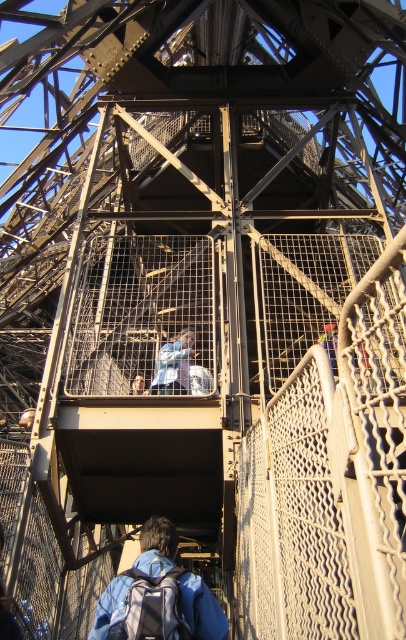
Does matte blue backpack at lower center have a larger size compared to light blue fabric at center?

Actually, matte blue backpack at lower center might be smaller than light blue fabric at center.

Between point (144, 625) and point (189, 339), which one is positioned in front?

Point (144, 625) is in front.

In order to click on matte blue backpack at lower center in this screenshot , I will do `click(151, 605)`.

Who is positioned more to the left, blue fabric backpack at lower center or matte blue backpack at lower center?

From the viewer's perspective, matte blue backpack at lower center appears more on the left side.

Who is taller, blue fabric backpack at lower center or matte blue backpack at lower center?

blue fabric backpack at lower center

Does point (172, 538) come behind point (133, 602)?

Yes, point (172, 538) is behind point (133, 602).

Where is `blue fabric backpack at lower center`? The width and height of the screenshot is (406, 640). blue fabric backpack at lower center is located at coordinates (157, 595).

Can you confirm if blue fabric backpack at lower center is positioned below light blue fabric at center?

Yes, blue fabric backpack at lower center is below light blue fabric at center.

Does point (125, 584) lie in front of point (185, 376)?

Yes.

Is point (213, 612) in front of point (168, 362)?

Yes, it is.

What are the coordinates of `blue fabric backpack at lower center` in the screenshot? It's located at (157, 595).